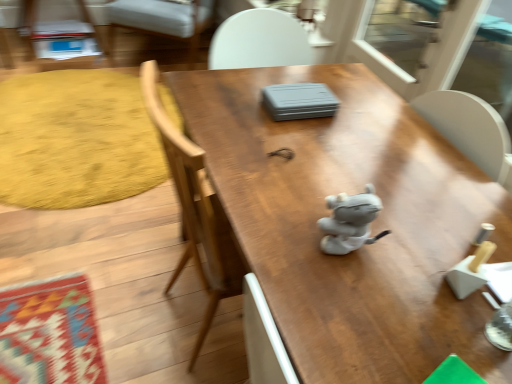
Question: Is gray fabric toy at center shorter than transparent plastic screen door at upper right?

Choices:
 (A) no
 (B) yes

Answer: (B)

Question: Is gray fabric toy at center turned away from transparent plastic screen door at upper right?

Choices:
 (A) yes
 (B) no

Answer: (B)

Question: Does gray fabric toy at center come behind transparent plastic screen door at upper right?

Choices:
 (A) yes
 (B) no

Answer: (B)

Question: Is gray fabric toy at center surrounding transparent plastic screen door at upper right?

Choices:
 (A) no
 (B) yes

Answer: (A)

Question: From the image's perspective, does gray fabric toy at center appear higher than transparent plastic screen door at upper right?

Choices:
 (A) yes
 (B) no

Answer: (B)

Question: Can you confirm if gray fabric toy at center is bigger than transparent plastic screen door at upper right?

Choices:
 (A) yes
 (B) no

Answer: (B)

Question: Is transparent plastic screen door at upper right to the left of gray fabric toy at center from the viewer's perspective?

Choices:
 (A) no
 (B) yes

Answer: (A)

Question: Is transparent plastic screen door at upper right at the right side of gray fabric toy at center?

Choices:
 (A) yes
 (B) no

Answer: (A)

Question: From a real-world perspective, is transparent plastic screen door at upper right over gray fabric toy at center?

Choices:
 (A) yes
 (B) no

Answer: (B)

Question: Is transparent plastic screen door at upper right taller than gray fabric toy at center?

Choices:
 (A) no
 (B) yes

Answer: (B)

Question: Can you confirm if transparent plastic screen door at upper right is shorter than gray fabric toy at center?

Choices:
 (A) yes
 (B) no

Answer: (B)

Question: Considering the relative sizes of transparent plastic screen door at upper right and gray fabric toy at center in the image provided, is transparent plastic screen door at upper right smaller than gray fabric toy at center?

Choices:
 (A) yes
 (B) no

Answer: (B)

Question: Does transparent plastic screen door at upper right have a greater width compared to yellow textured rug at left?

Choices:
 (A) yes
 (B) no

Answer: (B)